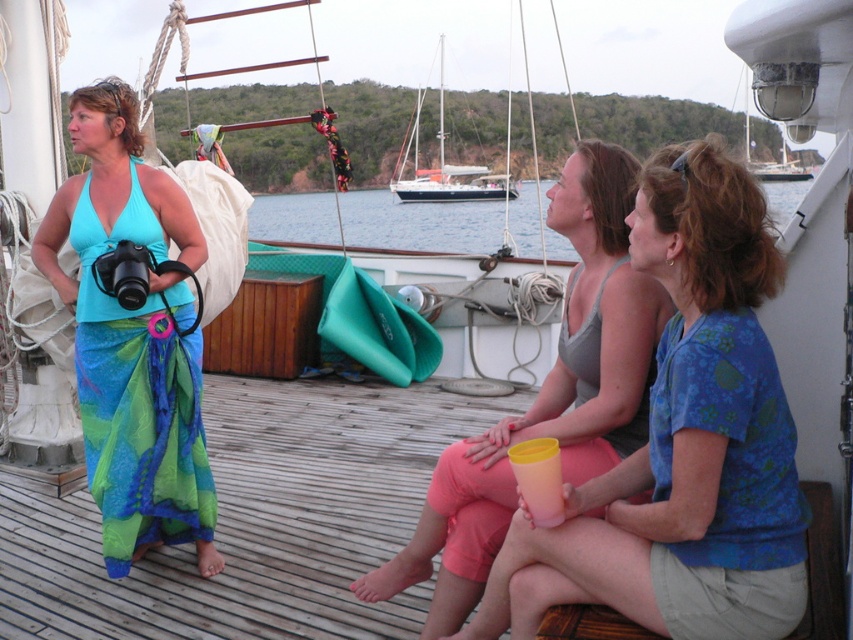
You are standing on the sailboat deck and want to place a small potted plant between the two points marked as point (x=137, y=490) and point (x=415, y=192). Which point should you position the plant closer to so it is nearer to the viewer?

You should position the plant closer to point (x=137, y=490) because it is closer to the viewer than point (x=415, y=192).

You are standing at point A with coordinates point A at (x=706, y=227) and want to reach point B at 0.645, 0.170. The distance between them is 6.20 feet. Can you walk directly from point A to point B without stepping on any of the wooden planks?

The distance between point A at (x=706, y=227) and point B at 0.645, 0.170 is 6.20 feet. Since the wooden planks are part of the deck, you would naturally step on them while walking from point A to point B.

You are standing on the deck of the sailboat and want to hand a message in a bottle to the person wearing the matte blue shirt at center. The white sailboat at center is blocking your direct path. Which direction should you move to reach the person without going around the sailboat?

Since the matte blue shirt at center is to the left of the white sailboat at center, you should move to the left side of the white sailboat at center to reach the person without going around it.